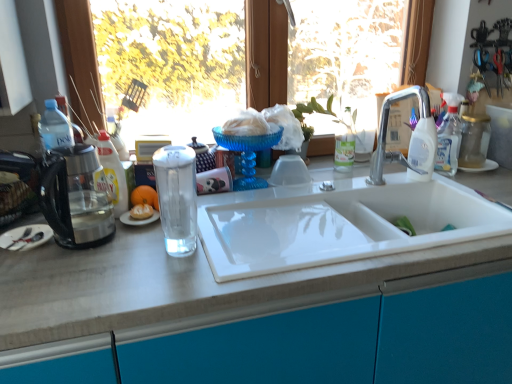
Question: Is point (431, 162) closer or farther from the camera than point (140, 208)?

Choices:
 (A) closer
 (B) farther

Answer: (B)

Question: From a real-world perspective, is white glossy bottle at upper right above or below white fluffy food at center?

Choices:
 (A) below
 (B) above

Answer: (B)

Question: Estimate the real-world distances between objects in this image. Which object is closer to the clear glass water at center?

Choices:
 (A) white fluffy food at center
 (B) clear glass bottle at left
 (C) white glossy bottle at upper right
 (D) translucent glass kettle at left
 (E) white matte plate at left

Answer: (A)

Question: Estimate the real-world distances between objects in this image. Which object is farther from the orange matte at center?

Choices:
 (A) transparent glass window at upper center
 (B) silver metallic faucet at upper right
 (C) clear glass bottle at left
 (D) white fluffy food at center
 (E) clear glass water at center

Answer: (B)